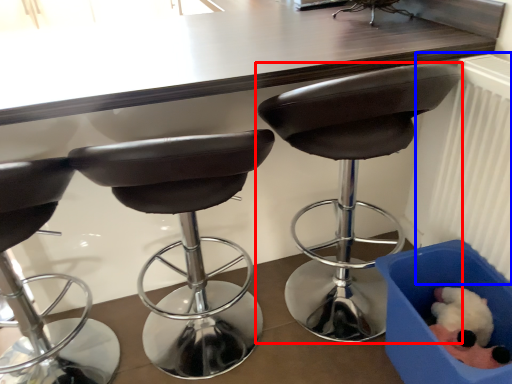
Question: Which of the following is the farthest to the observer, chair (highlighted by a red box) or radiator (highlighted by a blue box)?

Choices:
 (A) chair
 (B) radiator

Answer: (A)